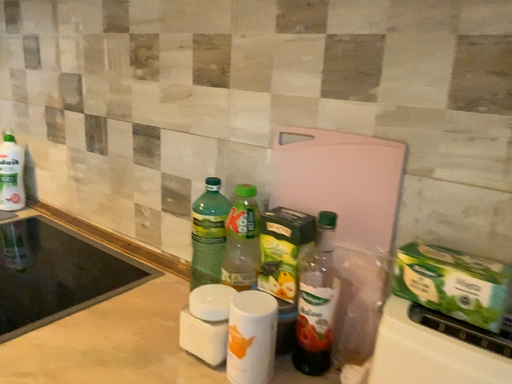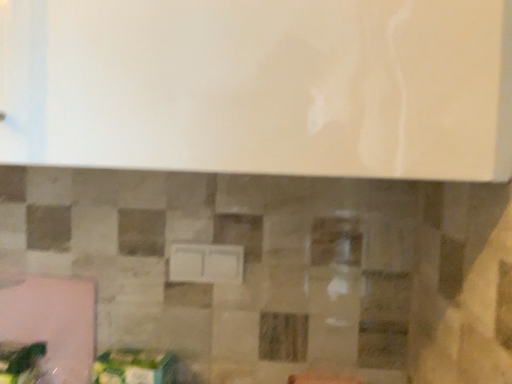
Question: How did the camera likely rotate when shooting the video?

Choices:
 (A) rotated right
 (B) rotated left

Answer: (A)